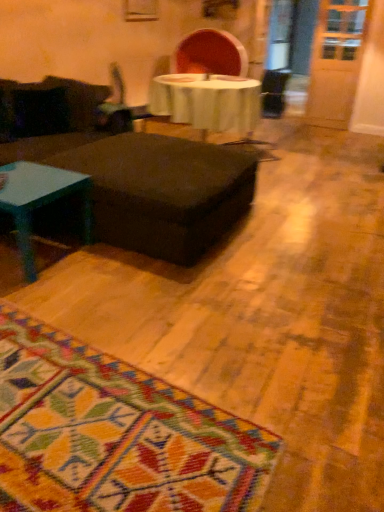
Locate an element on the screen. free space above teal glossy coffee table at left (from a real-world perspective) is located at coordinates (19, 180).